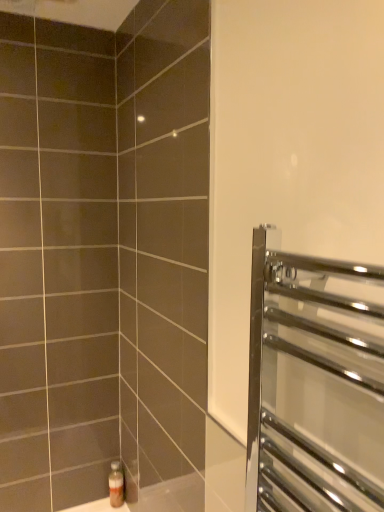
At what (x,y) coordinates should I click in order to perform the action: click on translucent plastic bottle at lower left. Please return your answer as a coordinate pair (x, y). Looking at the image, I should click on (116, 484).

The width and height of the screenshot is (384, 512). What do you see at coordinates (116, 484) in the screenshot?
I see `translucent plastic bottle at lower left` at bounding box center [116, 484].

Find the location of a particular element. The image size is (384, 512). translucent plastic bottle at lower left is located at coordinates (116, 484).